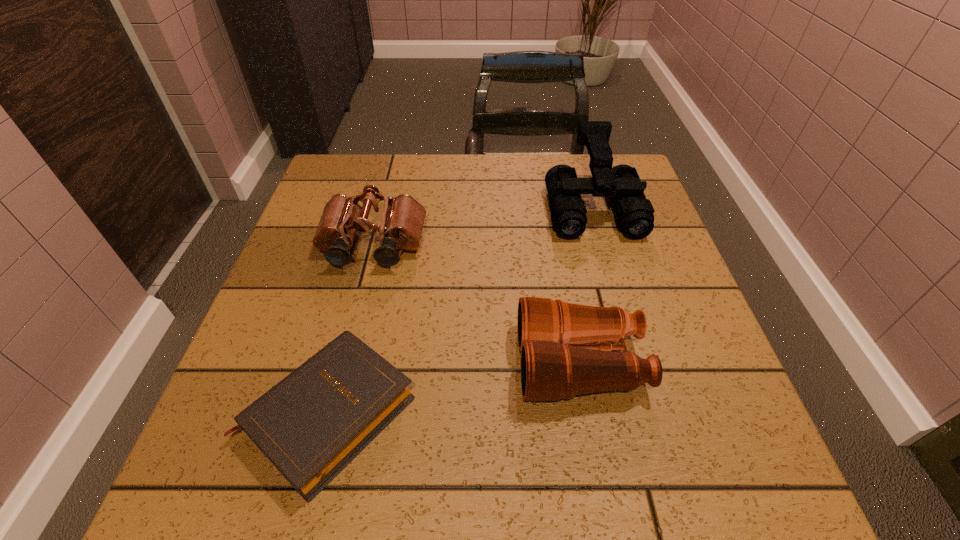
The image size is (960, 540). In order to click on object situated at the far edge in this screenshot , I will do `click(635, 214)`.

The image size is (960, 540). Find the location of `object that is at the near edge`. object that is at the near edge is located at coordinates (314, 422).

This screenshot has height=540, width=960. I want to click on binoculars present at the left edge, so click(402, 221).

This screenshot has height=540, width=960. In order to click on Bible present at the left edge in this screenshot , I will do `click(314, 422)`.

In order to click on object at the near left corner in this screenshot , I will do `click(314, 422)`.

At what (x,y) coordinates should I click in order to perform the action: click on object located in the far right corner section of the desktop. Please return your answer as a coordinate pair (x, y). This screenshot has height=540, width=960. Looking at the image, I should click on (635, 214).

Locate an element on the screen. free region at the far edge is located at coordinates (403, 168).

At what (x,y) coordinates should I click in order to perform the action: click on free space at the left edge. Please return your answer as a coordinate pair (x, y). This screenshot has width=960, height=540. Looking at the image, I should click on (348, 266).

The height and width of the screenshot is (540, 960). What are the coordinates of `free space at the right edge` in the screenshot? It's located at (685, 336).

Where is `vacant space at the far right corner`? vacant space at the far right corner is located at coordinates (589, 198).